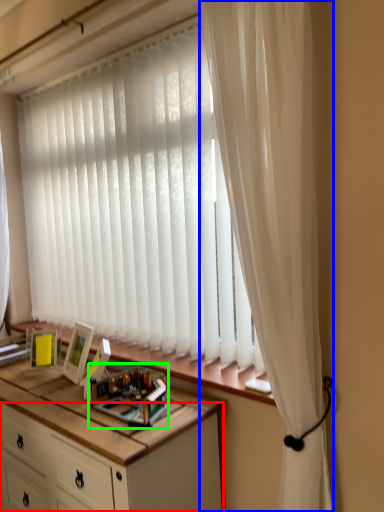
Question: Estimate the real-world distances between objects in this image. Which object is closer to cabinetry (highlighted by a red box), curtain (highlighted by a blue box) or toy (highlighted by a green box)?

Choices:
 (A) curtain
 (B) toy

Answer: (B)